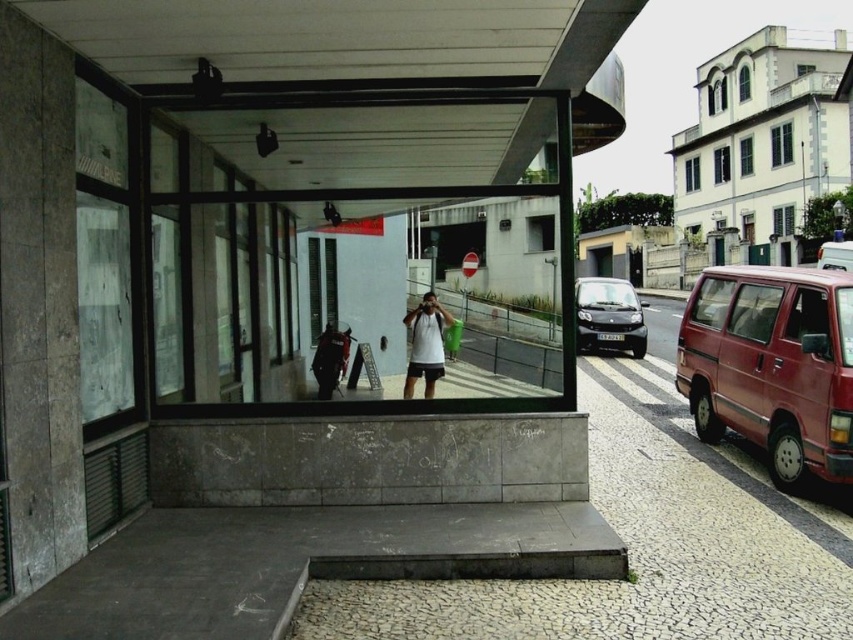
Question: Which object is the closest to the matte red van at right?

Choices:
 (A) white matte shirt at center
 (B) gray concrete pavement at center

Answer: (B)

Question: Can you confirm if matte red van at right is bigger than shiny black car at center?

Choices:
 (A) yes
 (B) no

Answer: (B)

Question: Which object appears closest to the camera in this image?

Choices:
 (A) matte red van at right
 (B) white matte shirt at center
 (C) metallic silver van at right

Answer: (A)

Question: Is matte red van at right closer to the viewer compared to shiny black car at center?

Choices:
 (A) yes
 (B) no

Answer: (A)

Question: Which of the following is the farthest from the observer?

Choices:
 (A) metallic silver van at right
 (B) gray concrete pavement at center
 (C) matte red van at right
 (D) shiny black car at center

Answer: (A)

Question: Observing the image, what is the correct spatial positioning of matte red van at right in reference to shiny black car at center?

Choices:
 (A) left
 (B) right

Answer: (B)